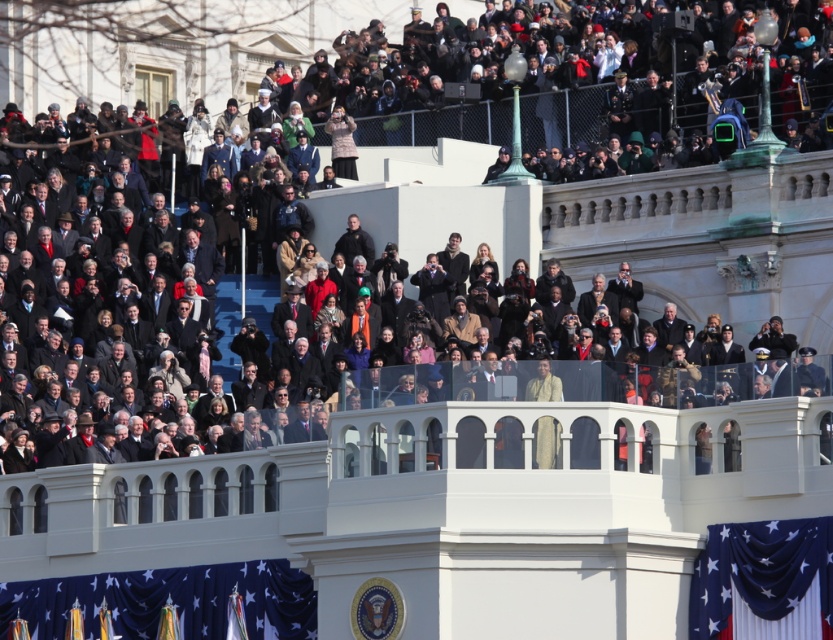
Question: Is blue fabric flag at lower left above blue velvet flag at lower right?

Choices:
 (A) no
 (B) yes

Answer: (A)

Question: Can you confirm if blue fabric flag at lower left is positioned to the left of blue velvet flag at lower right?

Choices:
 (A) no
 (B) yes

Answer: (B)

Question: Is blue fabric flag at lower left to the right of blue velvet flag at lower right from the viewer's perspective?

Choices:
 (A) yes
 (B) no

Answer: (B)